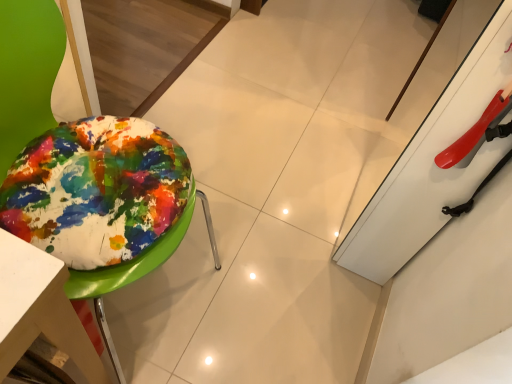
Describe the element at coordinates (26, 71) in the screenshot. The image size is (512, 384). I see `painted fabric cushion at left` at that location.

Image resolution: width=512 pixels, height=384 pixels. I want to click on painted fabric cushion at left, so click(26, 71).

Locate an element on the screen. The height and width of the screenshot is (384, 512). painted fabric cushion at left is located at coordinates (26, 71).